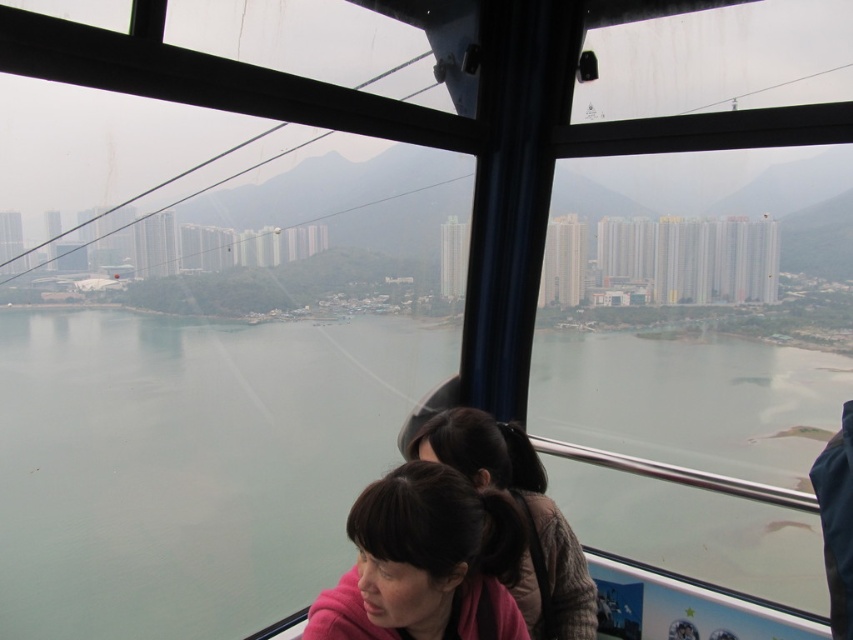
This screenshot has width=853, height=640. I want to click on pink fabric at lower center, so click(x=425, y=563).

Based on the photo, who is more distant from viewer, (432, 497) or (540, 616)?

Positioned behind is point (540, 616).

I want to click on pink fabric at lower center, so click(x=425, y=563).